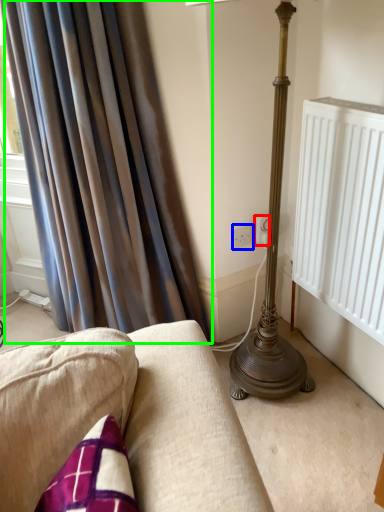
Question: Considering the real-world distances, which object is farthest from electric outlet (highlighted by a red box)? electric outlet (highlighted by a blue box) or curtain (highlighted by a green box)?

Choices:
 (A) electric outlet
 (B) curtain

Answer: (B)